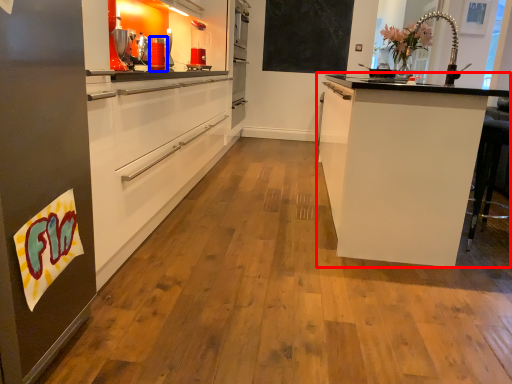
Question: Among these objects, which one is farthest to the camera, cabinetry (highlighted by a red box) or appliance (highlighted by a blue box)?

Choices:
 (A) cabinetry
 (B) appliance

Answer: (B)